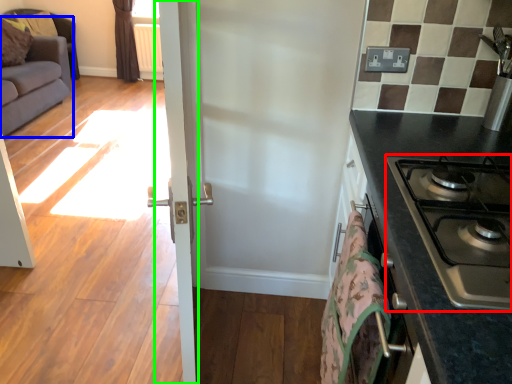
Question: Considering the real-world distances, which object is farthest from gas stove (highlighted by a red box)? studio couch (highlighted by a blue box) or screen door (highlighted by a green box)?

Choices:
 (A) studio couch
 (B) screen door

Answer: (A)